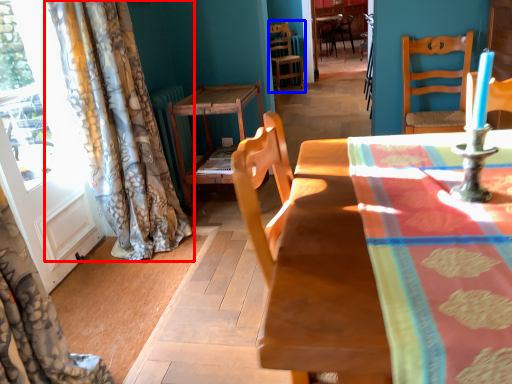
Question: Which point is closer to the camera, curtain (highlighted by a red box) or chair (highlighted by a blue box)?

Choices:
 (A) curtain
 (B) chair

Answer: (A)